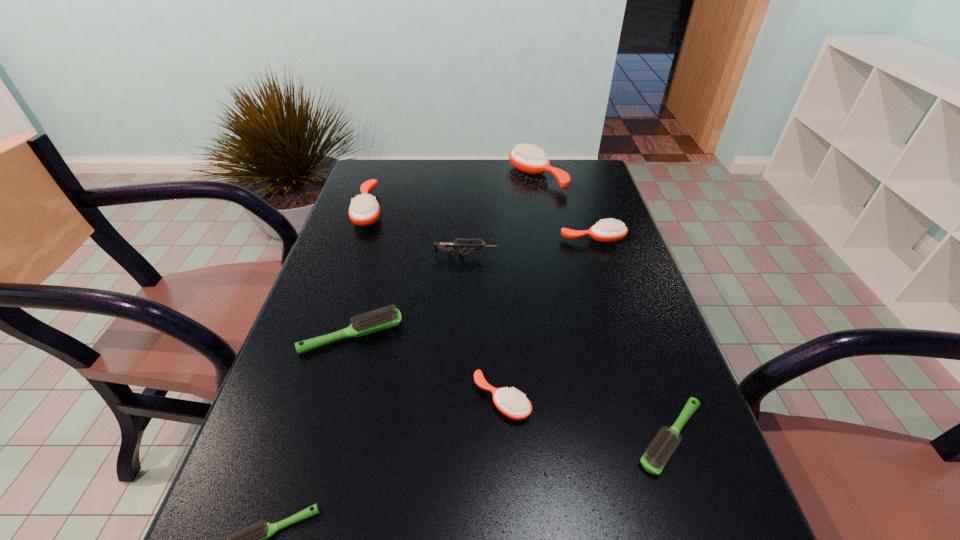
Identify the location of vacant space that satisfies the following two spatial constraints: 1. on the front side of the fifth farthest object; 2. on the left side of the leftmost orange hairbrush. (327, 335).

Find the location of a particular element. The image size is (960, 540). vacant space that satisfies the following two spatial constraints: 1. on the back side of the fifth shortest hairbrush; 2. on the right side of the smallest orange hairbrush is located at coordinates (495, 239).